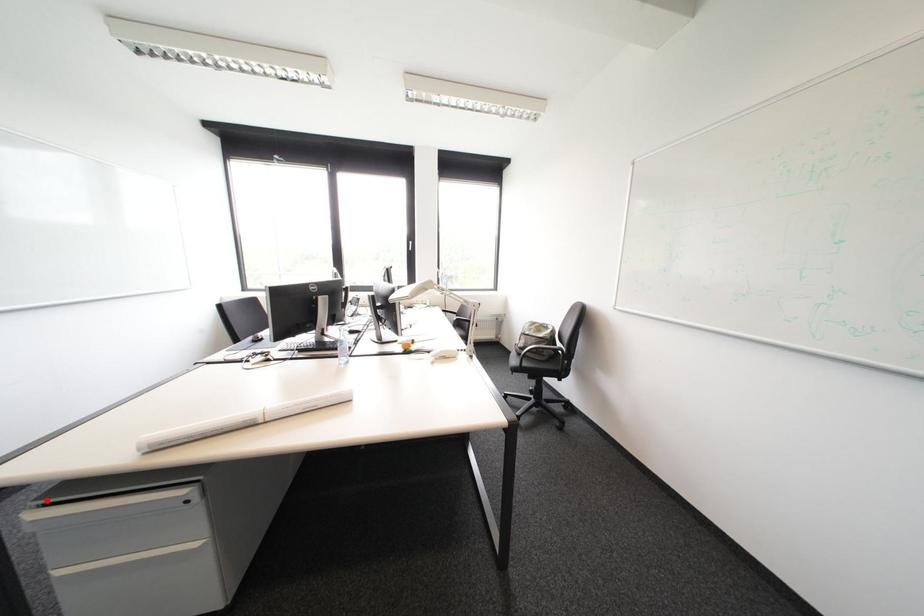
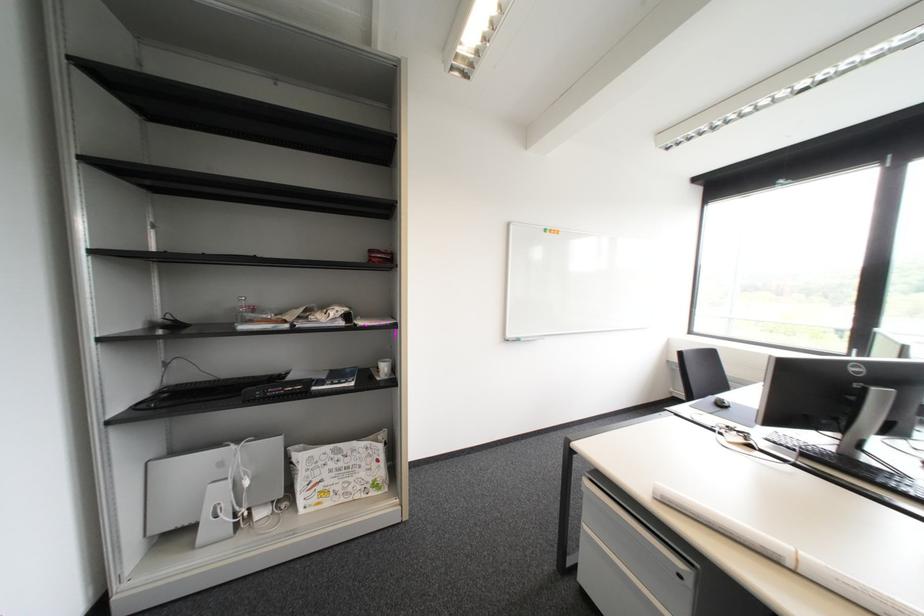
Question: I am providing you with two images of the same scene from different viewpoints. Image1 has a red point marked. In image2, the corresponding 3D location appears at what relative position? Reply with the corresponding letter.

Choices:
 (A) Closer
 (B) Farther

Answer: (B)